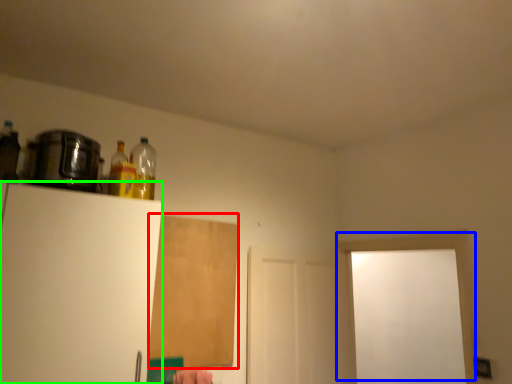
Question: Which is nearer to the plywood (highlighted by a red box)? door (highlighted by a blue box) or appliance (highlighted by a green box).

Choices:
 (A) door
 (B) appliance

Answer: (B)